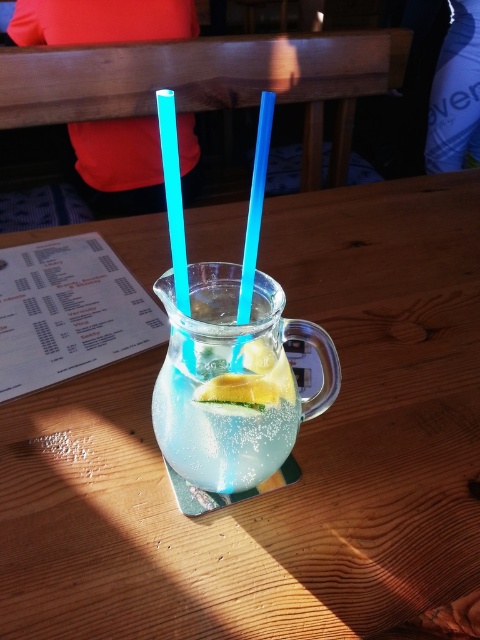
You are a customer at a cafe and want to grab the yellow matte lemon at center. However, there is a clear glass pitcher at center in the way. Can you reach the lemon without moving the pitcher?

The clear glass pitcher at center is to the left of the yellow matte lemon at center, so you can reach the lemon by moving your hand around the pitcher to the right side since the pitcher is not blocking the entire path.

You are a customer at a cafe and you see the clear glass pitcher at center and the yellow matte lemon at center on the table. Which object is closer to you?

The yellow matte lemon at center is closer to you because the clear glass pitcher at center is located above it, meaning the lemon is beneath the pitcher and thus nearer to your viewpoint.

You are a customer at a cafe and want to place your phone on the wooden table at center. However, there is a yellow matte lemon at center already on the table. Can you still place your phone on the table without moving the lemon?

The wooden table at center has a larger size compared to yellow matte lemon at center, so there is enough space to place your phone on the table without moving the lemon.